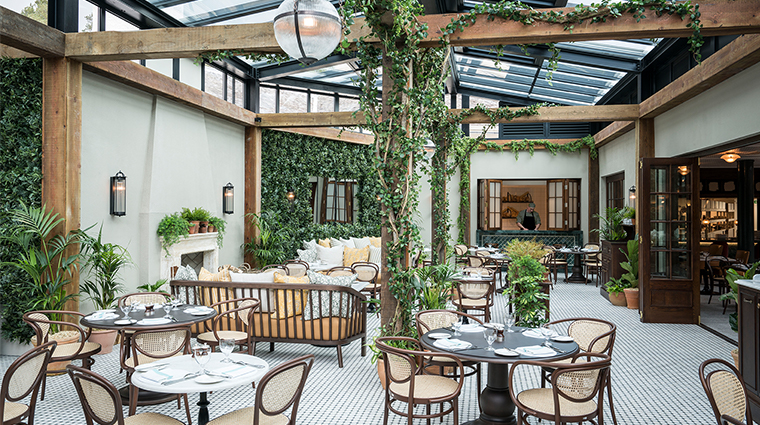
In order to click on window in this screenshot , I will do `click(334, 192)`.